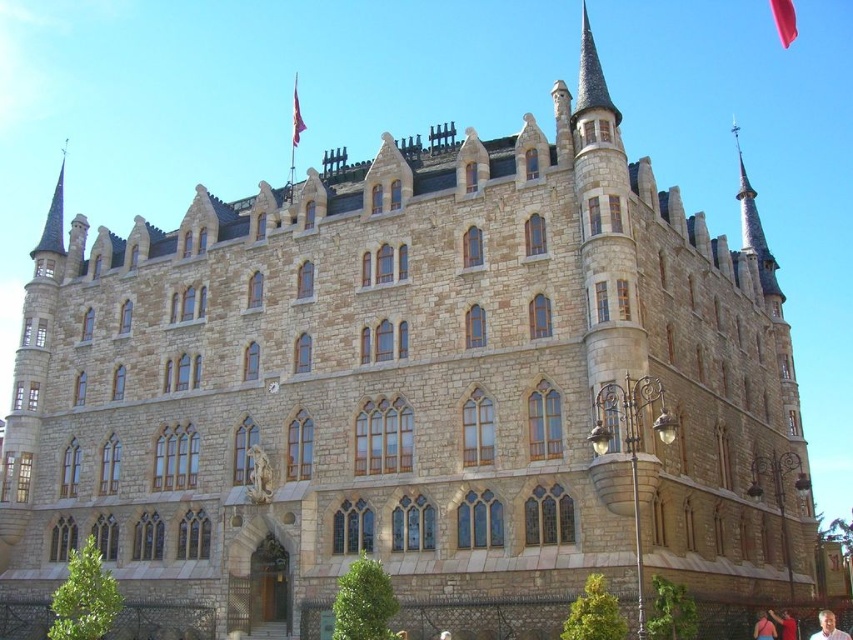
Question: Which object is positioned farthest from the red shirt at lower right?

Choices:
 (A) red fabric shirt at lower right
 (B) white hair at lower right

Answer: (B)

Question: Is white hair at lower right thinner than red shirt at lower right?

Choices:
 (A) no
 (B) yes

Answer: (A)

Question: Is white hair at lower right to the right of red shirt at lower right from the viewer's perspective?

Choices:
 (A) yes
 (B) no

Answer: (A)

Question: Among these points, which one is farthest from the camera?

Choices:
 (A) pos(769,628)
 (B) pos(834,636)

Answer: (A)

Question: Which of these objects is positioned farthest from the white hair at lower right?

Choices:
 (A) red fabric shirt at lower right
 (B) red shirt at lower right

Answer: (A)

Question: Does red shirt at lower right have a greater width compared to red fabric shirt at lower right?

Choices:
 (A) yes
 (B) no

Answer: (A)